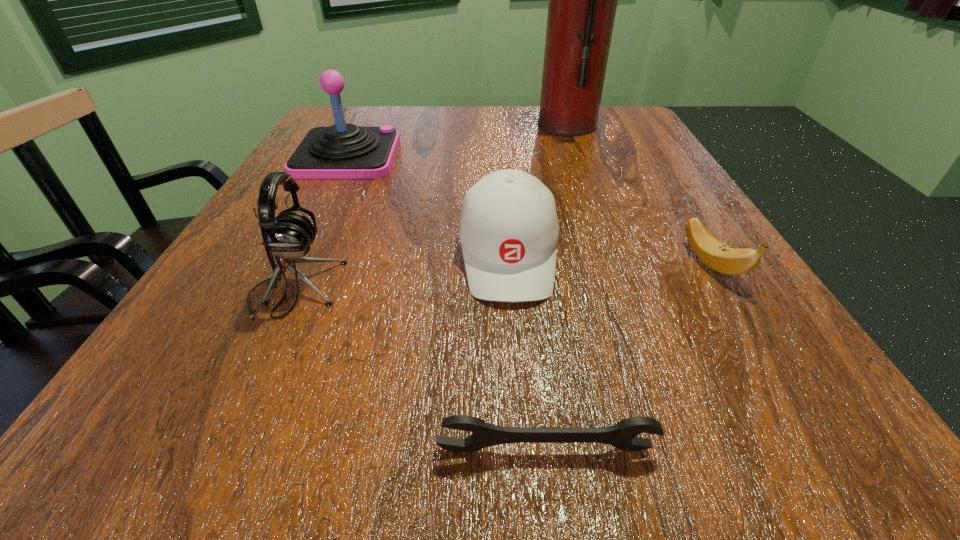
The image size is (960, 540). Identify the location of fire extinguisher at the right edge. (583, 0).

Locate an element on the screen. The image size is (960, 540). banana that is at the right edge is located at coordinates (720, 257).

Locate an element on the screen. This screenshot has width=960, height=540. object that is at the far left corner is located at coordinates (342, 151).

Find the location of a particular element. This screenshot has height=540, width=960. object that is at the far right corner is located at coordinates (583, 0).

This screenshot has height=540, width=960. In order to click on vacant point at the far edge in this screenshot , I will do tap(425, 140).

Image resolution: width=960 pixels, height=540 pixels. Identify the location of vacant space at the near edge of the desktop. (544, 415).

At what (x,y) coordinates should I click in order to perform the action: click on free region at the left edge of the desktop. Please return your answer as a coordinate pair (x, y). The image size is (960, 540). Looking at the image, I should click on (169, 343).

Image resolution: width=960 pixels, height=540 pixels. What are the coordinates of `free space at the right edge` in the screenshot? It's located at 665,300.

The image size is (960, 540). Identify the location of free location at the far right corner. (635, 137).

At what (x,y) coordinates should I click in order to perform the action: click on free space that is in between the fire extinguisher and the banana. Please return your answer as a coordinate pair (x, y). This screenshot has height=540, width=960. Looking at the image, I should click on (640, 194).